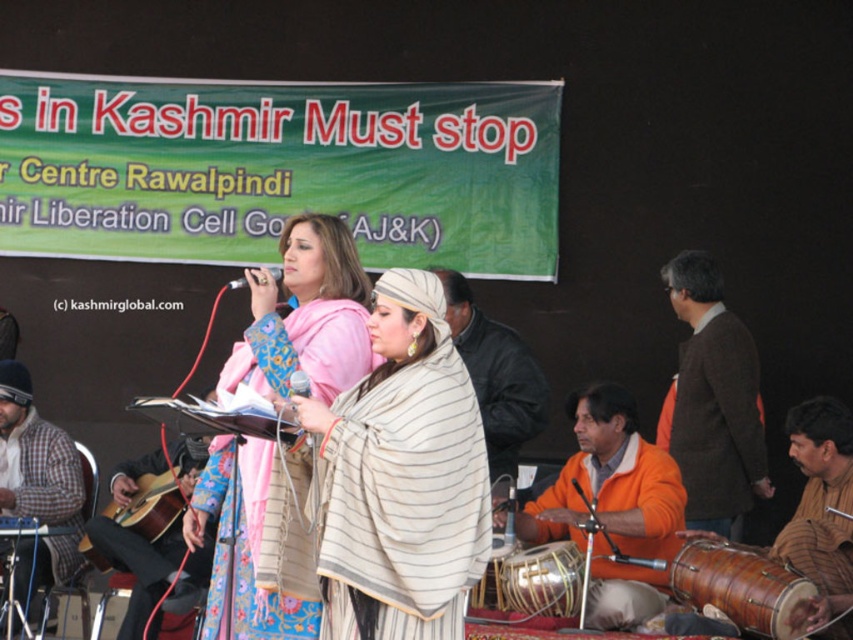
In the scene shown: Does wooden drum at lower right have a greater height compared to wooden drum at center?

Correct, wooden drum at lower right is much taller as wooden drum at center.

Is wooden drum at lower right thinner than wooden drum at center?

No.

Measure the distance between point [714,548] and camera.

Point [714,548] is 6.92 meters away from camera.

Image resolution: width=853 pixels, height=640 pixels. In order to click on wooden drum at lower right in this screenshot , I will do `click(741, 586)`.

Does point (752, 349) lie in front of point (543, 554)?

No.

Can you confirm if brown woolen sweater at right is thinner than wooden drum at center?

Incorrect, brown woolen sweater at right's width is not less than wooden drum at center's.

Does point (688, 486) come in front of point (505, 561)?

No, (688, 486) is behind (505, 561).

Image resolution: width=853 pixels, height=640 pixels. I want to click on brown woolen sweater at right, so click(x=712, y=401).

Does matte pink dress at center lie in front of orange cotton tunic at lower right?

Yes, it is.

You are a GUI agent. You are given a task and a screenshot of the screen. Output one action in this format:
    pyautogui.click(x=<x>, y=<y>)
    Task: Click on the matte pink dress at center
    The height and width of the screenshot is (640, 853).
    Given the screenshot: What is the action you would take?
    pyautogui.click(x=306, y=316)